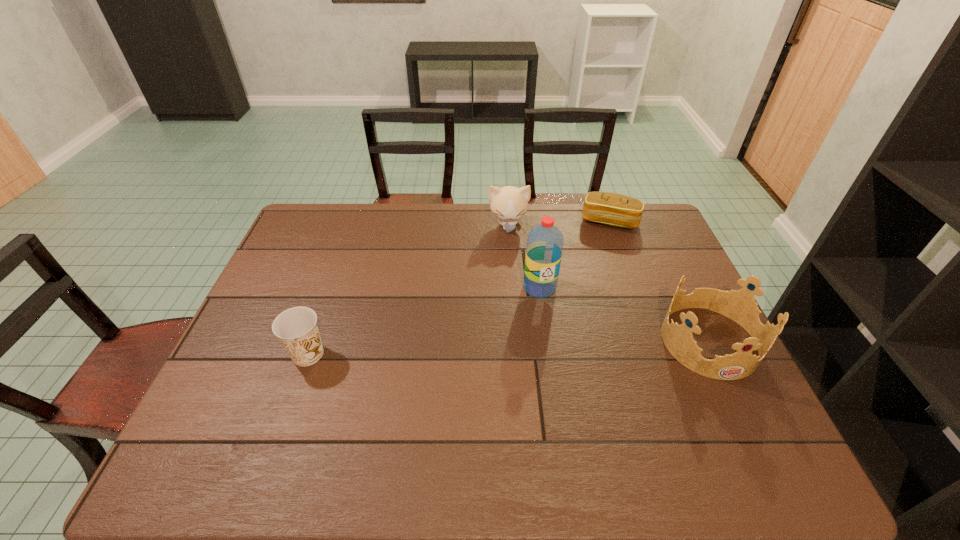
Where is `free space located on the zipper side of the shortest object`? This screenshot has height=540, width=960. free space located on the zipper side of the shortest object is located at coordinates (589, 268).

This screenshot has height=540, width=960. What are the coordinates of `free space located on the zipper side of the shortest object` in the screenshot? It's located at (576, 308).

Identify the location of vacant space located on the front label of the tallest object. tap(547, 345).

Where is `vacant region located 0.240m on the front label of the tallest object`? Image resolution: width=960 pixels, height=540 pixels. vacant region located 0.240m on the front label of the tallest object is located at coordinates (550, 367).

I want to click on vacant space situated on the front label of the tallest object, so click(557, 420).

You are a GUI agent. You are given a task and a screenshot of the screen. Output one action in this format:
    pyautogui.click(x=<x>, y=<y>)
    Task: Click on the vacant region located on the face of the kitten
    This screenshot has width=960, height=540.
    Given the screenshot: What is the action you would take?
    pyautogui.click(x=513, y=268)

This screenshot has height=540, width=960. Find the location of `vacant space located on the face of the kitten`. vacant space located on the face of the kitten is located at coordinates (515, 284).

At what (x,y) coordinates should I click in order to perform the action: click on free region located on the face of the kitten. Please return your answer as a coordinate pair (x, y). Looking at the image, I should click on (518, 322).

At what (x,y) coordinates should I click in order to perform the action: click on clutch bag at the far edge. Please return your answer as a coordinate pair (x, y). The width and height of the screenshot is (960, 540). Looking at the image, I should click on (613, 209).

This screenshot has height=540, width=960. Find the location of `kitten that is at the far edge`. kitten that is at the far edge is located at coordinates (509, 203).